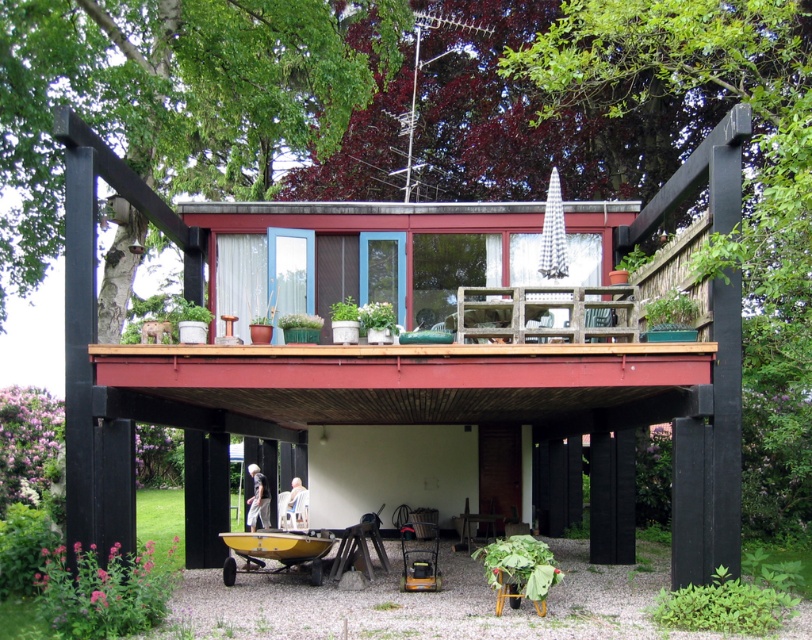
Question: Which of the following is the closest to the observer?

Choices:
 (A) black wood pergola at center
 (B) white fabric chair at lower center

Answer: (A)

Question: Estimate the real-world distances between objects in this image. Which object is closer to the black wood pergola at center?

Choices:
 (A) white fabric chair at lower center
 (B) light gray fabric pants at lower center

Answer: (A)

Question: Which of the following is the farthest from the observer?

Choices:
 (A) black wood pergola at center
 (B) light gray fabric pants at lower center
 (C) white fabric chair at lower center

Answer: (B)

Question: Is white fabric chair at lower center to the left of light gray fabric pants at lower center from the viewer's perspective?

Choices:
 (A) no
 (B) yes

Answer: (A)

Question: Is white fabric chair at lower center wider than light gray fabric pants at lower center?

Choices:
 (A) yes
 (B) no

Answer: (A)

Question: Is white fabric chair at lower center positioned before light gray fabric pants at lower center?

Choices:
 (A) no
 (B) yes

Answer: (B)